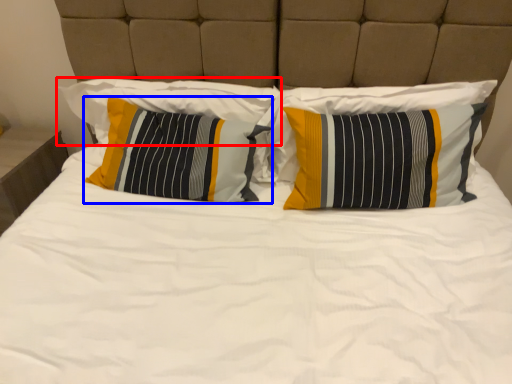
Question: Which object appears closest to the camera in this image, pillow (highlighted by a red box) or pillow (highlighted by a blue box)?

Choices:
 (A) pillow
 (B) pillow

Answer: (B)